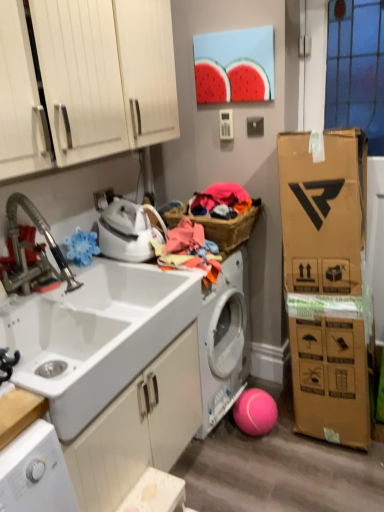
Question: Can you see white matte cabinet at lower center, the second cabinetry viewed from the top, touching white glossy iron at upper left?

Choices:
 (A) yes
 (B) no

Answer: (B)

Question: Is white matte cabinet at lower center, the first cabinetry positioned from the bottom, thinner than white glossy iron at upper left?

Choices:
 (A) yes
 (B) no

Answer: (B)

Question: Is white glossy iron at upper left at the back of white matte cabinet at lower center, the second cabinetry viewed from the top?

Choices:
 (A) yes
 (B) no

Answer: (B)

Question: From the image's perspective, would you say white matte cabinet at lower center, the second cabinetry viewed from the top, is positioned over white glossy iron at upper left?

Choices:
 (A) no
 (B) yes

Answer: (A)

Question: Is white matte cabinet at lower center, the first cabinetry positioned from the bottom, smaller than white glossy iron at upper left?

Choices:
 (A) no
 (B) yes

Answer: (A)

Question: Is white glossy iron at upper left in front of or behind woven wicker basket at center in the image?

Choices:
 (A) behind
 (B) front

Answer: (B)

Question: Choose the correct answer: Is white glossy iron at upper left inside woven wicker basket at center or outside it?

Choices:
 (A) outside
 (B) inside

Answer: (A)

Question: Is white glossy iron at upper left taller or shorter than woven wicker basket at center?

Choices:
 (A) tall
 (B) short

Answer: (A)

Question: Is white glossy iron at upper left wider or thinner than woven wicker basket at center?

Choices:
 (A) thin
 (B) wide

Answer: (A)

Question: From a real-world perspective, relative to woven wicker basket at center, is brushed metal faucet at left vertically above or below?

Choices:
 (A) above
 (B) below

Answer: (A)

Question: In the image, is brushed metal faucet at left positioned in front of or behind woven wicker basket at center?

Choices:
 (A) behind
 (B) front

Answer: (B)

Question: In terms of size, does brushed metal faucet at left appear bigger or smaller than woven wicker basket at center?

Choices:
 (A) big
 (B) small

Answer: (A)

Question: From the image's perspective, is brushed metal faucet at left located above or below woven wicker basket at center?

Choices:
 (A) below
 (B) above

Answer: (A)

Question: Is white glossy sink at left wider or thinner than woven wicker basket at center?

Choices:
 (A) wide
 (B) thin

Answer: (A)

Question: In the image, is white glossy sink at left positioned in front of or behind woven wicker basket at center?

Choices:
 (A) front
 (B) behind

Answer: (A)